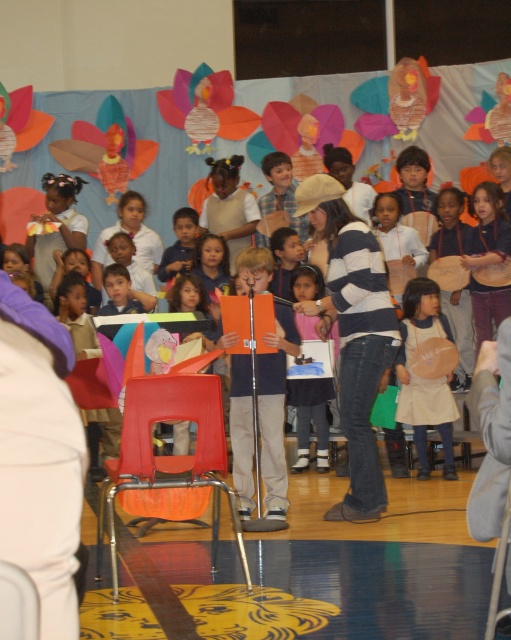
Question: Can you confirm if beige fabric apron at center is positioned to the right of pink fabric dress at center?

Choices:
 (A) no
 (B) yes

Answer: (B)

Question: Among these points, which one is nearest to the camera?

Choices:
 (A) (303, 404)
 (B) (335, 182)
 (C) (417, 336)

Answer: (B)

Question: Is striped sweater at center above beige fabric apron at center?

Choices:
 (A) no
 (B) yes

Answer: (B)

Question: Which is farther from the pink fabric dress at center?

Choices:
 (A) beige fabric apron at center
 (B) striped sweater at center

Answer: (B)

Question: Which is nearer to the striped sweater at center?

Choices:
 (A) beige fabric apron at center
 (B) pink fabric dress at center

Answer: (A)

Question: In this image, where is striped sweater at center located relative to beige fabric apron at center?

Choices:
 (A) left
 (B) right

Answer: (A)